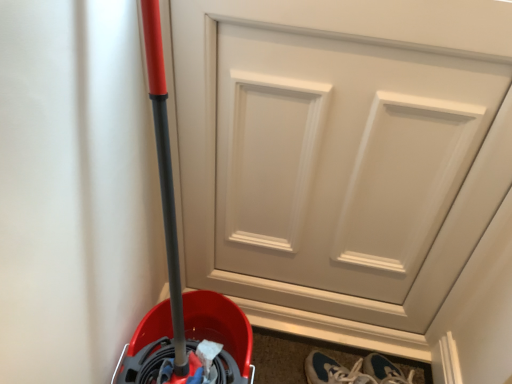
Question: Should I look upward or downward to see white matte door at center?

Choices:
 (A) up
 (B) down

Answer: (B)

Question: Is blue suede sneakers at lower right with white matte door at center?

Choices:
 (A) no
 (B) yes

Answer: (A)

Question: From the image's perspective, is blue suede sneakers at lower right below white matte door at center?

Choices:
 (A) no
 (B) yes

Answer: (B)

Question: Does blue suede sneakers at lower right have a lesser height compared to white matte door at center?

Choices:
 (A) yes
 (B) no

Answer: (A)

Question: From the image's perspective, is blue suede sneakers at lower right on top of white matte door at center?

Choices:
 (A) no
 (B) yes

Answer: (A)

Question: Can we say blue suede sneakers at lower right lies outside white matte door at center?

Choices:
 (A) yes
 (B) no

Answer: (A)

Question: Considering the relative sizes of blue suede sneakers at lower right and white matte door at center in the image provided, is blue suede sneakers at lower right smaller than white matte door at center?

Choices:
 (A) yes
 (B) no

Answer: (A)

Question: Is white matte door at center far away from blue suede sneakers at lower right?

Choices:
 (A) no
 (B) yes

Answer: (A)

Question: Considering the relative sizes of white matte door at center and blue suede sneakers at lower right in the image provided, is white matte door at center bigger than blue suede sneakers at lower right?

Choices:
 (A) yes
 (B) no

Answer: (A)

Question: Is blue suede sneakers at lower right at the back of white matte door at center?

Choices:
 (A) no
 (B) yes

Answer: (A)

Question: Is white matte door at center located outside blue suede sneakers at lower right?

Choices:
 (A) yes
 (B) no

Answer: (A)

Question: Is white matte door at center taller than blue suede sneakers at lower right?

Choices:
 (A) no
 (B) yes

Answer: (B)

Question: Is the position of white matte door at center more distant than that of blue suede sneakers at lower right?

Choices:
 (A) yes
 (B) no

Answer: (B)

Question: Is blue suede sneakers at lower right inside or outside of white matte door at center?

Choices:
 (A) outside
 (B) inside

Answer: (A)